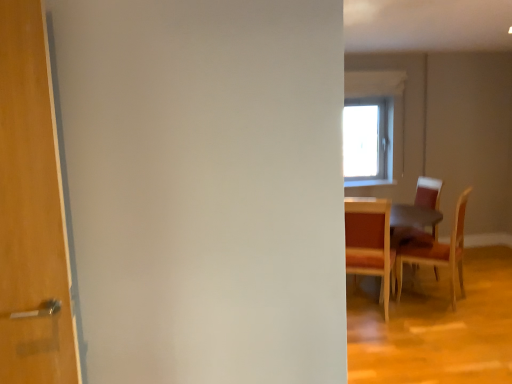
Question: Considering the relative sizes of wooden table at right and wooden chair at right, which is counted as the 3th chair, starting from the right, in the image provided, is wooden table at right taller than wooden chair at right, which is counted as the 3th chair, starting from the right,?

Choices:
 (A) no
 (B) yes

Answer: (A)

Question: Is wooden table at right far away from wooden chair at right, which is counted as the 3th chair, starting from the right?

Choices:
 (A) no
 (B) yes

Answer: (A)

Question: Is wooden table at right thinner than wooden chair at right, the 1th chair in the left-to-right sequence?

Choices:
 (A) yes
 (B) no

Answer: (B)

Question: From a real-world perspective, is wooden table at right physically above wooden chair at right, the 1th chair in the left-to-right sequence?

Choices:
 (A) yes
 (B) no

Answer: (B)

Question: Can you confirm if wooden table at right is wider than wooden chair at right, which is counted as the 3th chair, starting from the right?

Choices:
 (A) yes
 (B) no

Answer: (A)

Question: From their relative heights in the image, would you say wooden chair at right, which is counted as the 3th chair, starting from the right, is taller or shorter than wooden chair at right, the 1th chair positioned from the right?

Choices:
 (A) tall
 (B) short

Answer: (B)

Question: Considering the positions of point (385, 269) and point (455, 279), is point (385, 269) closer or farther from the camera than point (455, 279)?

Choices:
 (A) farther
 (B) closer

Answer: (B)

Question: In the image, is wooden chair at right, the 1th chair in the left-to-right sequence, on the left side or the right side of wooden chair at right, the 1th chair positioned from the right?

Choices:
 (A) right
 (B) left

Answer: (B)

Question: In terms of width, does wooden chair at right, which is counted as the 3th chair, starting from the right, look wider or thinner when compared to wooden chair at right, which is the 3th chair from left to right?

Choices:
 (A) thin
 (B) wide

Answer: (B)

Question: Is wooden chair at right, which is counted as the 3th chair, starting from the right, wider or thinner than wooden table at right?

Choices:
 (A) wide
 (B) thin

Answer: (B)

Question: Is point (384, 221) closer or farther from the camera than point (361, 259)?

Choices:
 (A) farther
 (B) closer

Answer: (B)

Question: Is wooden chair at right, the 1th chair in the left-to-right sequence, spatially inside wooden table at right, or outside of it?

Choices:
 (A) inside
 (B) outside

Answer: (A)

Question: Would you say wooden chair at right, the 1th chair in the left-to-right sequence, is to the left or to the right of wooden table at right in the picture?

Choices:
 (A) left
 (B) right

Answer: (A)

Question: From a real-world perspective, is wooden chair at right, the second chair viewed from the left, positioned above or below wooden chair at right, which is the 3th chair from left to right?

Choices:
 (A) above
 (B) below

Answer: (A)

Question: In the image, is wooden chair at right, acting as the 2th chair starting from the right, positioned in front of or behind wooden chair at right, which is the 3th chair from left to right?

Choices:
 (A) behind
 (B) front

Answer: (A)